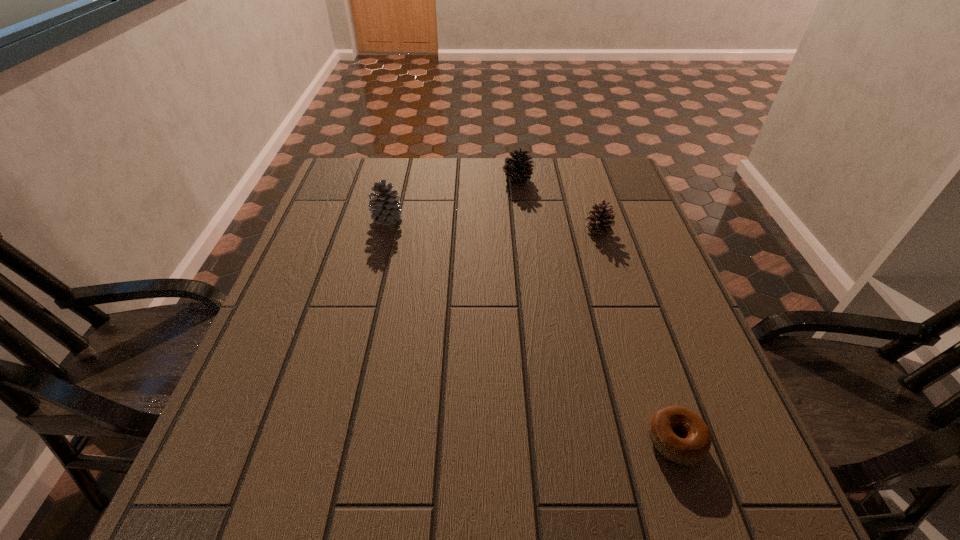
Where is `vacant space located on the left of the shortest pinecone`? vacant space located on the left of the shortest pinecone is located at coordinates (558, 228).

Where is `vacant space positioned 0.330m on the back of the bagel`? vacant space positioned 0.330m on the back of the bagel is located at coordinates (624, 286).

Where is `object that is at the far edge`? The height and width of the screenshot is (540, 960). object that is at the far edge is located at coordinates pyautogui.click(x=518, y=168).

The image size is (960, 540). Find the location of `object that is at the near edge`. object that is at the near edge is located at coordinates (692, 448).

I want to click on object at the left edge, so click(x=384, y=206).

This screenshot has height=540, width=960. In order to click on pinecone at the right edge in this screenshot , I will do `click(599, 222)`.

The width and height of the screenshot is (960, 540). Find the location of `bagel located at the right edge`. bagel located at the right edge is located at coordinates (692, 448).

At what (x,y) coordinates should I click in order to perform the action: click on object that is at the near right corner. Please return your answer as a coordinate pair (x, y). This screenshot has height=540, width=960. Looking at the image, I should click on (692, 448).

Locate an element on the screen. Image resolution: width=960 pixels, height=540 pixels. vacant space at the far edge of the desktop is located at coordinates click(399, 197).

In the image, there is a desktop. What are the coordinates of `free region at the near edge` in the screenshot? It's located at (585, 524).